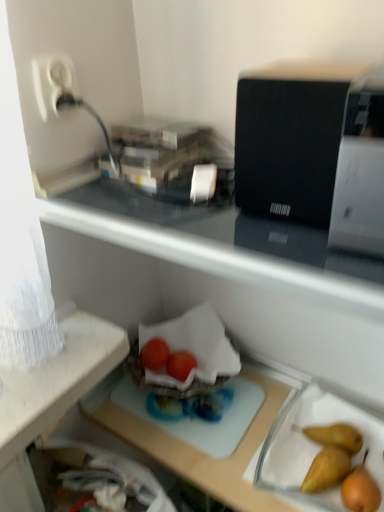
The image size is (384, 512). I want to click on spots to the right of glossy plastic tomatoes at center, the first green vegetables when ordered from left to right, so click(224, 397).